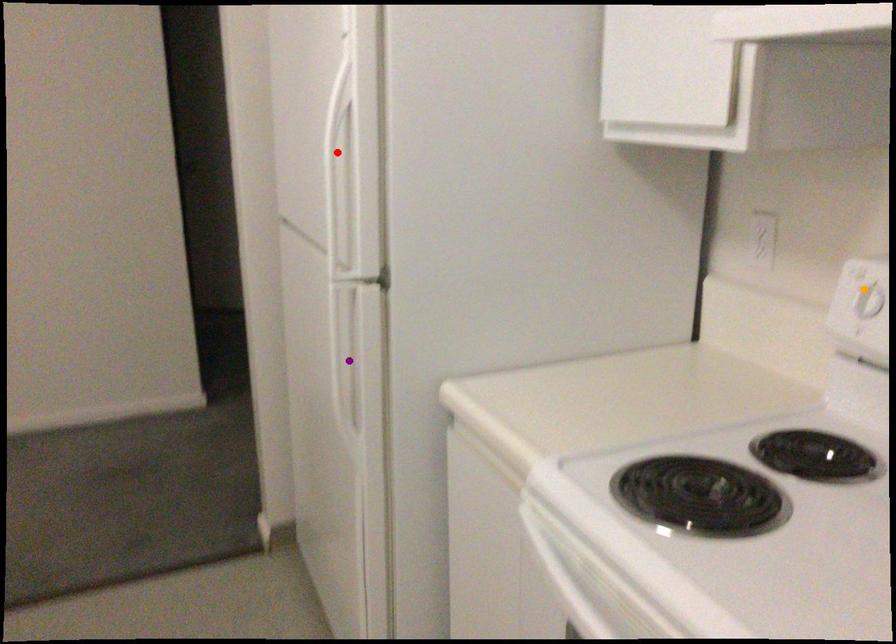
In the scene shown: Order these from farthest to nearest:
red point | orange point | purple point

purple point
red point
orange point